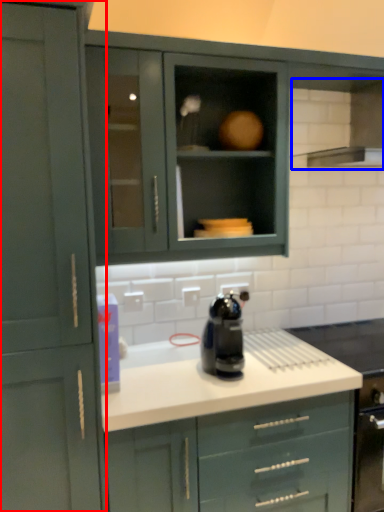
Question: Among these objects, which one is farthest to the camera, cabinetry (highlighted by a red box) or exhaust hood (highlighted by a blue box)?

Choices:
 (A) cabinetry
 (B) exhaust hood

Answer: (B)